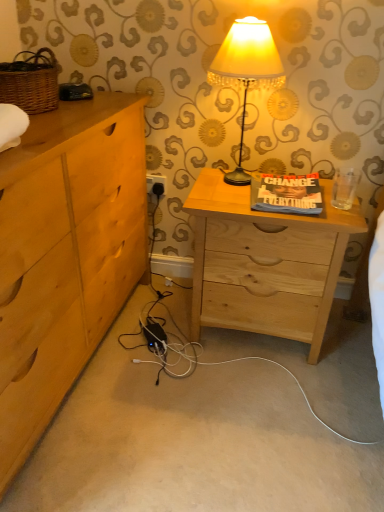
Identify the location of natural wood nightstand at center. (265, 263).

What is the approximate width of white plastic electric outlet at lower center?

white plastic electric outlet at lower center is 1.02 inches in width.

The height and width of the screenshot is (512, 384). What do you see at coordinates (246, 70) in the screenshot?
I see `matte cream lampshade at center` at bounding box center [246, 70].

This screenshot has width=384, height=512. Find the location of `natural wood nightstand at center`. natural wood nightstand at center is located at coordinates (265, 263).

Is light wood chest of drawers at left facing away from matte cream lampshade at center?

light wood chest of drawers at left does not have its back to matte cream lampshade at center.

Who is more distant, light wood chest of drawers at left or matte cream lampshade at center?

matte cream lampshade at center.

Looking at this image, from the image's perspective, would you say light wood chest of drawers at left is shown under matte cream lampshade at center?

Yes, from the image's perspective, light wood chest of drawers at left is beneath matte cream lampshade at center.

Measure the distance between matte cream lampshade at center and white plastic electric outlet at lower center.

They are 22.63 inches apart.

Between matte cream lampshade at center and white plastic electric outlet at lower center, which one is positioned in front?

Positioned in front is matte cream lampshade at center.

Where is `electric outlet located below the matte cream lampshade at center (from the image's perspective)`? The image size is (384, 512). electric outlet located below the matte cream lampshade at center (from the image's perspective) is located at coordinates (155, 184).

Based on the photo, considering the relative sizes of matte cream lampshade at center and white plastic electric outlet at lower center in the image provided, is matte cream lampshade at center bigger than white plastic electric outlet at lower center?

Indeed, matte cream lampshade at center has a larger size compared to white plastic electric outlet at lower center.

Consider the image. Relative to white plastic electric outlet at lower center, is natural wood nightstand at center in front or behind?

natural wood nightstand at center is in front of white plastic electric outlet at lower center.

Between natural wood nightstand at center and white plastic electric outlet at lower center, which one has less height?

With less height is white plastic electric outlet at lower center.

Is white plastic electric outlet at lower center a part of natural wood nightstand at center?

No, white plastic electric outlet at lower center is not surrounded by natural wood nightstand at center.

In the scene shown: Is matte cream lampshade at center aimed at light wood chest of drawers at left?

No, matte cream lampshade at center is not aimed at light wood chest of drawers at left.

Based on the photo, considering the sizes of objects matte cream lampshade at center and light wood chest of drawers at left in the image provided, who is smaller, matte cream lampshade at center or light wood chest of drawers at left?

matte cream lampshade at center.

Would you say light wood chest of drawers at left is part of matte cream lampshade at center's contents?

No.

Is point (219, 60) behind point (30, 366)?

That is True.

From the image's perspective, is white plastic electric outlet at lower center above matte cream lampshade at center?

No, from the image's perspective, white plastic electric outlet at lower center is not on top of matte cream lampshade at center.

Where is `lamp on the right of white plastic electric outlet at lower center`? The width and height of the screenshot is (384, 512). lamp on the right of white plastic electric outlet at lower center is located at coordinates (246, 70).

In terms of width, does white plastic electric outlet at lower center look wider or thinner when compared to matte cream lampshade at center?

In the image, white plastic electric outlet at lower center appears to be more narrow than matte cream lampshade at center.

Which is less distant, (x=104, y=140) or (x=250, y=298)?

The point (x=104, y=140) is closer.

Considering the sizes of objects light wood chest of drawers at left and natural wood nightstand at center in the image provided, who is shorter, light wood chest of drawers at left or natural wood nightstand at center?

natural wood nightstand at center.

Considering the relative sizes of light wood chest of drawers at left and natural wood nightstand at center in the image provided, is light wood chest of drawers at left thinner than natural wood nightstand at center?

Incorrect, the width of light wood chest of drawers at left is not less than that of natural wood nightstand at center.

How many degrees apart are the facing directions of light wood chest of drawers at left and white plastic electric outlet at lower center?

The angle between the facing direction of light wood chest of drawers at left and the facing direction of white plastic electric outlet at lower center is 89.3 degrees.

Is the surface of light wood chest of drawers at left in direct contact with white plastic electric outlet at lower center?

light wood chest of drawers at left is not next to white plastic electric outlet at lower center, and they're not touching.

Is light wood chest of drawers at left taller than white plastic electric outlet at lower center?

Yes, light wood chest of drawers at left is taller than white plastic electric outlet at lower center.

Considering the sizes of objects light wood chest of drawers at left and white plastic electric outlet at lower center in the image provided, who is wider, light wood chest of drawers at left or white plastic electric outlet at lower center?

light wood chest of drawers at left is wider.

At what (x,y) coordinates should I click in order to perform the action: click on lamp above the light wood chest of drawers at left (from a real-world perspective). Please return your answer as a coordinate pair (x, y). Image resolution: width=384 pixels, height=512 pixels. Looking at the image, I should click on (246, 70).

Locate an element on the screen. The image size is (384, 512). electric outlet on the left of matte cream lampshade at center is located at coordinates (155, 184).

Looking at the image, which one is located closer to white plastic electric outlet at lower center, matte cream lampshade at center or natural wood nightstand at center?

matte cream lampshade at center is closer to white plastic electric outlet at lower center.

When comparing their distances from natural wood nightstand at center, does light wood chest of drawers at left or matte cream lampshade at center seem closer?

matte cream lampshade at center is positioned closer to the anchor natural wood nightstand at center.

Based on their spatial positions, is matte cream lampshade at center or white plastic electric outlet at lower center further from natural wood nightstand at center?

white plastic electric outlet at lower center is positioned further to the anchor natural wood nightstand at center.

From the image, which object appears to be farther from matte cream lampshade at center, light wood chest of drawers at left or natural wood nightstand at center?

Based on the image, light wood chest of drawers at left appears to be further to matte cream lampshade at center.

Considering their positions, is white plastic electric outlet at lower center positioned closer to matte cream lampshade at center than natural wood nightstand at center?

Based on the image, natural wood nightstand at center appears to be nearer to matte cream lampshade at center.

Based on their spatial positions, is natural wood nightstand at center or white plastic electric outlet at lower center further from light wood chest of drawers at left?

The object further to light wood chest of drawers at left is white plastic electric outlet at lower center.

Looking at the image, which one is located further to matte cream lampshade at center, white plastic electric outlet at lower center or light wood chest of drawers at left?

Among the two, light wood chest of drawers at left is located further to matte cream lampshade at center.

Based on the photo, looking at the image, which one is located further to natural wood nightstand at center, matte cream lampshade at center or light wood chest of drawers at left?

Based on the image, light wood chest of drawers at left appears to be further to natural wood nightstand at center.

Identify the location of nightstand between matte cream lampshade at center and white plastic electric outlet at lower center along the z-axis. This screenshot has height=512, width=384. (265, 263).

In order to click on lamp between light wood chest of drawers at left and natural wood nightstand at center in this screenshot , I will do `click(246, 70)`.

Identify the location of nightstand between light wood chest of drawers at left and white plastic electric outlet at lower center from front to back. point(265,263).

You are a GUI agent. You are given a task and a screenshot of the screen. Output one action in this format:
    pyautogui.click(x=<x>, y=<y>)
    Task: Click on the lamp located between light wood chest of drawers at left and white plastic electric outlet at lower center in the depth direction
    
    Given the screenshot: What is the action you would take?
    coord(246,70)